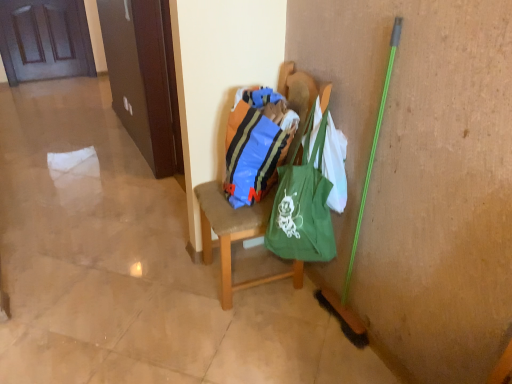
Locate an element on the screen. The image size is (512, 384). vacant space to the left of wooden chair at center is located at coordinates (168, 296).